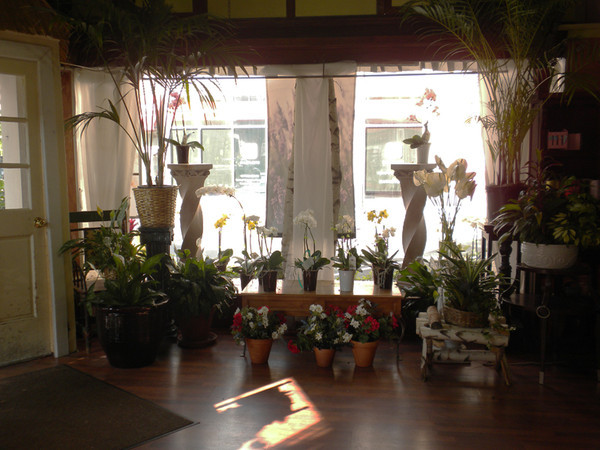
Where is `window`? window is located at coordinates click(230, 155).